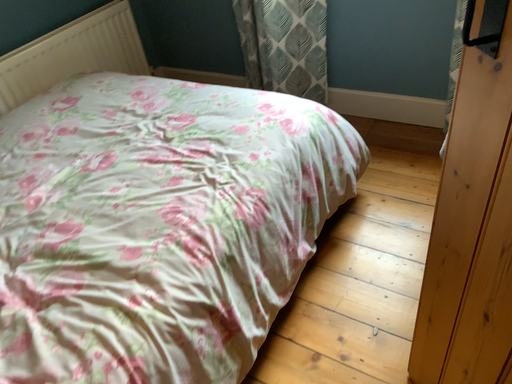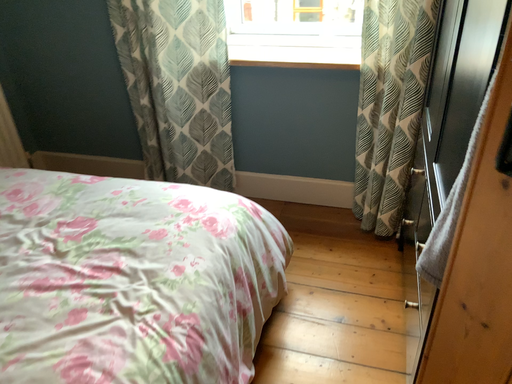
Question: How did the camera likely rotate when shooting the video?

Choices:
 (A) rotated downward
 (B) rotated upward

Answer: (B)